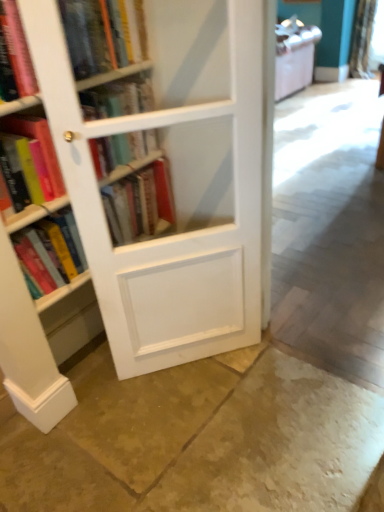
At what (x,y) coordinates should I click in order to perform the action: click on vacant region to the left of white wood bookcase at left. Please return your answer as a coordinate pair (x, y). This screenshot has width=384, height=512. Looking at the image, I should click on (102, 395).